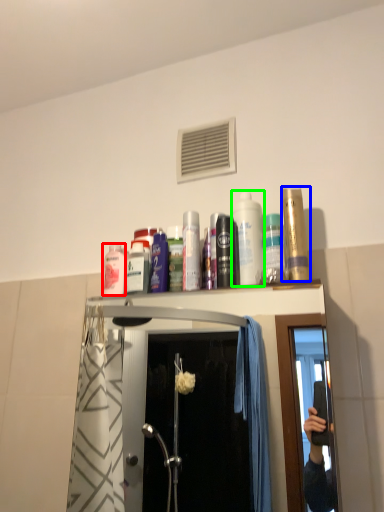
Question: Which object is positioned closest to mouthwash (highlighted by a red box)? Select from mouthwash (highlighted by a blue box) and mouthwash (highlighted by a green box).

Choices:
 (A) mouthwash
 (B) mouthwash

Answer: (B)